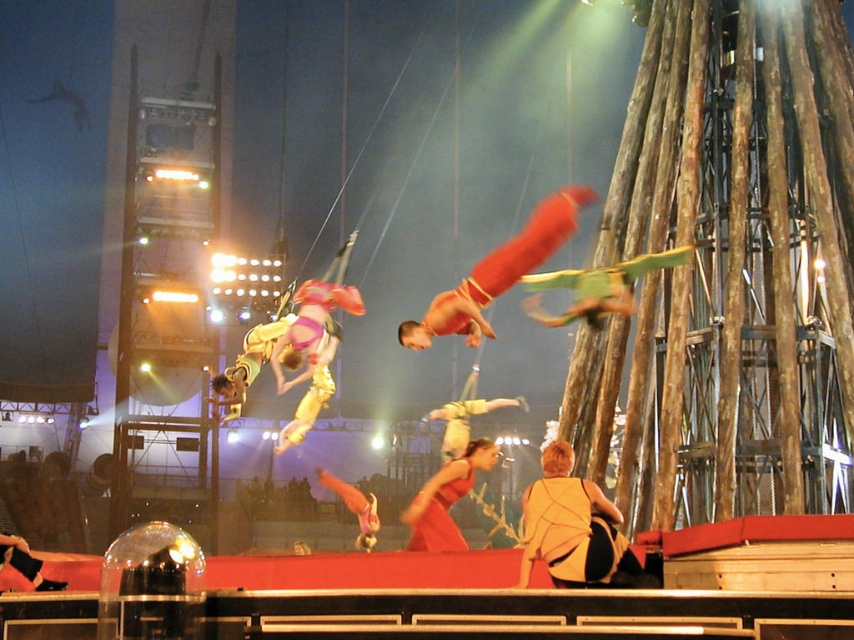
You are a stagehand observing the circus performance. You notice two objects labeled as the yellow fabric at center and the yellow fabric acrobat at center. Which one is positioned higher in the air?

The yellow fabric at center is positioned higher in the air than the yellow fabric acrobat at center because it is described as being above the acrobat.